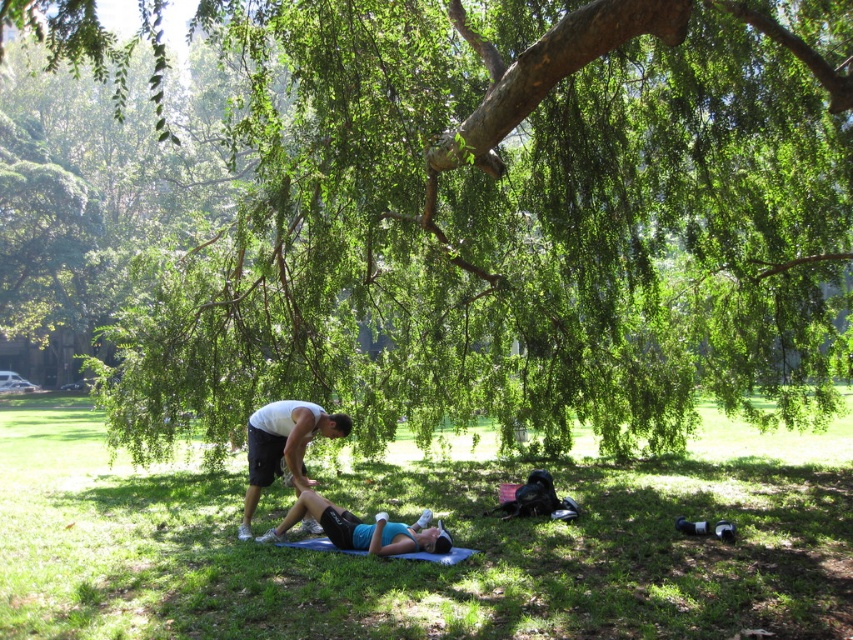
Question: Estimate the real-world distances between objects in this image. Which object is farther from the blue fabric mat at lower center?

Choices:
 (A) green grass at lower center
 (B) green leafy tree at center

Answer: (B)

Question: Which of the following is the closest to the observer?

Choices:
 (A) green grass at lower center
 (B) white matte shirt at center
 (C) green leafy tree at center

Answer: (C)

Question: Is matte white shirt at center bigger than blue fabric mat at lower center?

Choices:
 (A) yes
 (B) no

Answer: (A)

Question: Which of the following is the closest to the observer?

Choices:
 (A) (410, 524)
 (B) (421, 344)

Answer: (A)

Question: Does matte white shirt at center have a greater width compared to white matte shirt at center?

Choices:
 (A) no
 (B) yes

Answer: (B)

Question: Is green grass at lower center above white matte shirt at center?

Choices:
 (A) no
 (B) yes

Answer: (A)